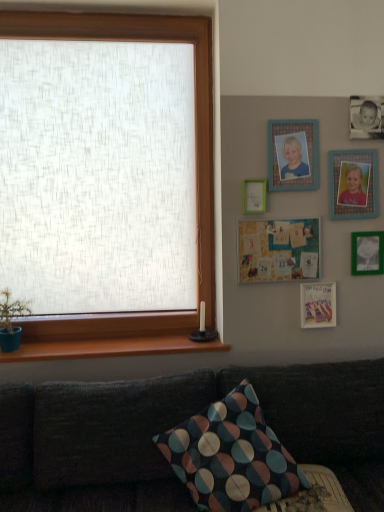
Question: Does dark fabric couch at lower left have a greater height compared to green matte picture frame at lower right, which is counted as the 2th picture frame, starting from the bottom?

Choices:
 (A) no
 (B) yes

Answer: (B)

Question: Considering the relative sizes of dark fabric couch at lower left and green matte picture frame at lower right, which is the 5th picture frame from top to bottom, in the image provided, is dark fabric couch at lower left smaller than green matte picture frame at lower right, which is the 5th picture frame from top to bottom,?

Choices:
 (A) no
 (B) yes

Answer: (A)

Question: Can you confirm if dark fabric couch at lower left is bigger than green matte picture frame at lower right, which is the 5th picture frame from top to bottom?

Choices:
 (A) no
 (B) yes

Answer: (B)

Question: Is dark fabric couch at lower left positioned with its back to green matte picture frame at lower right, which is counted as the 2th picture frame, starting from the bottom?

Choices:
 (A) no
 (B) yes

Answer: (A)

Question: Is dark fabric couch at lower left positioned beyond the bounds of green matte picture frame at lower right, which is counted as the 2th picture frame, starting from the bottom?

Choices:
 (A) no
 (B) yes

Answer: (B)

Question: Is dark fabric couch at lower left to the left of green matte picture frame at lower right, which is counted as the 2th picture frame, starting from the bottom, from the viewer's perspective?

Choices:
 (A) yes
 (B) no

Answer: (A)

Question: From a real-world perspective, is multicolored fabric pillow at lower center under wooden at lower left?

Choices:
 (A) no
 (B) yes

Answer: (B)

Question: From the image's perspective, would you say multicolored fabric pillow at lower center is shown under wooden at lower left?

Choices:
 (A) no
 (B) yes

Answer: (B)

Question: Does multicolored fabric pillow at lower center have a smaller size compared to wooden at lower left?

Choices:
 (A) no
 (B) yes

Answer: (A)

Question: Can you confirm if multicolored fabric pillow at lower center is bigger than wooden at lower left?

Choices:
 (A) yes
 (B) no

Answer: (A)

Question: Is multicolored fabric pillow at lower center aimed at wooden at lower left?

Choices:
 (A) yes
 (B) no

Answer: (B)

Question: Is multicolored fabric pillow at lower center looking in the opposite direction of wooden at lower left?

Choices:
 (A) no
 (B) yes

Answer: (B)

Question: From the image's perspective, does dark fabric couch at lower left appear higher than multicolored fabric pillow at lower center?

Choices:
 (A) no
 (B) yes

Answer: (A)